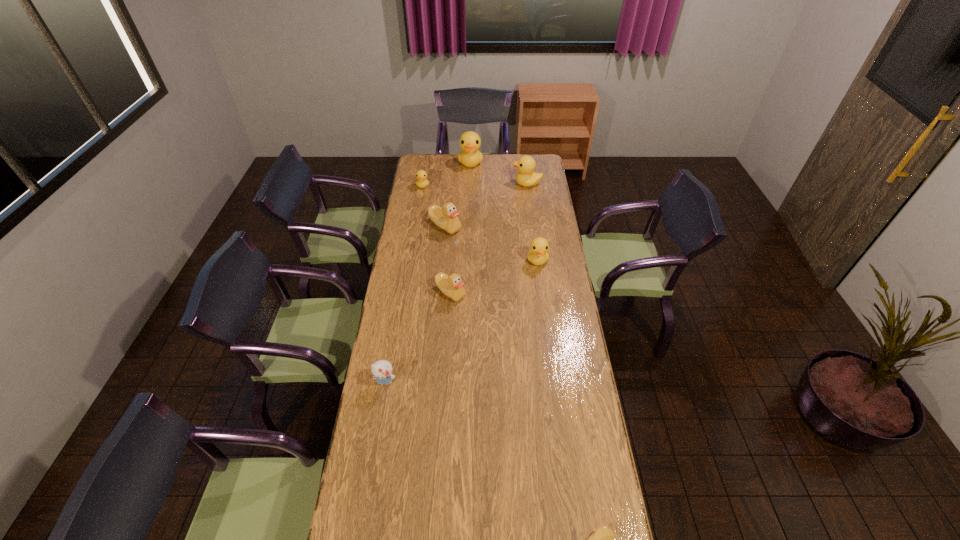
The image size is (960, 540). Identify the location of vacant space that satisfies the following two spatial constraints: 1. on the face of the third smallest yellow duck; 2. at the beak of the sixth farthest duck. [x=541, y=293].